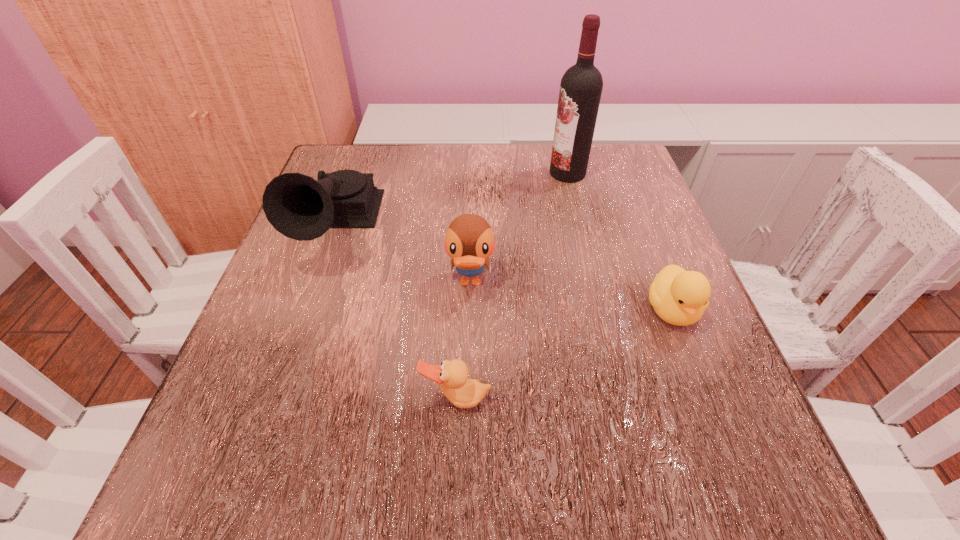
Locate an element on the screen. This screenshot has width=960, height=540. vacant area situated on the label of the wine bottle is located at coordinates (502, 173).

Find the location of a particular element. This screenshot has width=960, height=540. free location located 0.090m on the label of the wine bottle is located at coordinates (511, 173).

The height and width of the screenshot is (540, 960). In order to click on free space located from the horn of the second tallest object in this screenshot , I will do `click(250, 476)`.

Identify the location of free space located 0.140m on the front-facing side of the third shortest object. (468, 377).

Locate an element on the screen. The height and width of the screenshot is (540, 960). free location located on the front-facing side of the fourth tallest object is located at coordinates (735, 472).

At what (x,y) coordinates should I click in order to perform the action: click on free space located 0.090m on the beak of the shortest duck. Please return your answer as a coordinate pair (x, y). The height and width of the screenshot is (540, 960). Looking at the image, I should click on (453, 480).

Identify the location of wine bottle that is at the far edge. (581, 86).

Locate an element on the screen. Image resolution: width=960 pixels, height=540 pixels. phonograph_record situated at the far edge is located at coordinates (299, 207).

Locate an element on the screen. This screenshot has width=960, height=540. object that is at the left edge is located at coordinates (299, 207).

Locate an element on the screen. The image size is (960, 540). wine bottle that is positioned at the right edge is located at coordinates (581, 86).